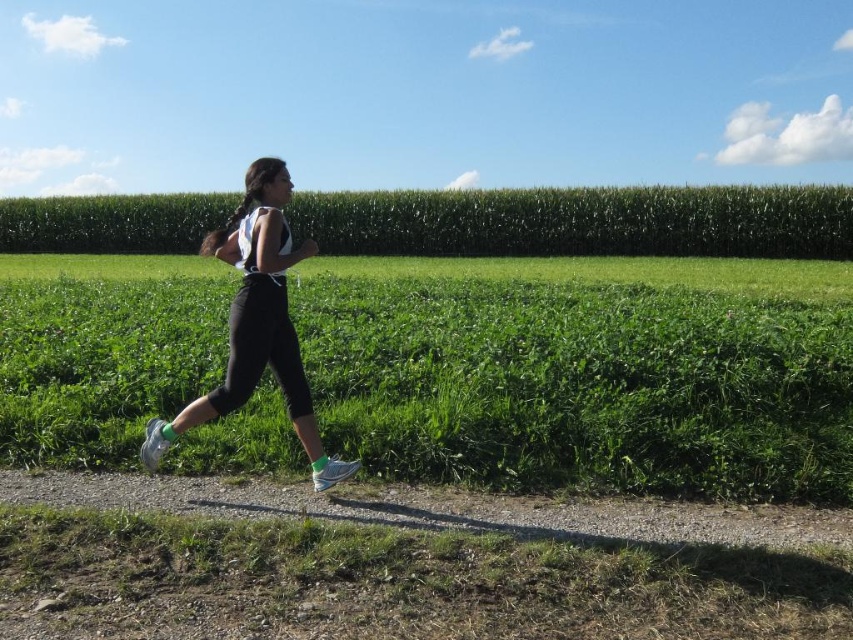
You are a GUI agent. You are given a task and a screenshot of the screen. Output one action in this format:
    pyautogui.click(x=<x>, y=<y>)
    Task: Click on the shiny silver shoe at lower left
    This screenshot has width=853, height=640.
    Given the screenshot: What is the action you would take?
    pyautogui.click(x=154, y=444)

Can you confirm if shiny silver shoe at lower left is positioned to the right of white mesh running shoe at lower center?

Incorrect, shiny silver shoe at lower left is not on the right side of white mesh running shoe at lower center.

At what (x,y) coordinates should I click in order to perform the action: click on shiny silver shoe at lower left. Please return your answer as a coordinate pair (x, y). This screenshot has width=853, height=640. Looking at the image, I should click on (154, 444).

Image resolution: width=853 pixels, height=640 pixels. I want to click on shiny silver shoe at lower left, so click(154, 444).

Which is above, green grassy corn field at upper center or white mesh running shoe at lower center?

green grassy corn field at upper center

Is point (814, 236) closer to viewer compared to point (346, 474)?

No, (814, 236) is further to viewer.

Locate an element on the screen. green grassy corn field at upper center is located at coordinates tap(582, 221).

Consider the image. Does gravel path at center have a larger size compared to shiny silver shoe at lower left?

Yes.

Who is more forward, (758, 532) or (142, 445)?

Positioned in front is point (758, 532).

Which is in front, point (357, 502) or point (157, 432)?

Point (357, 502)

Locate an element on the screen. The height and width of the screenshot is (640, 853). gravel path at center is located at coordinates (440, 508).